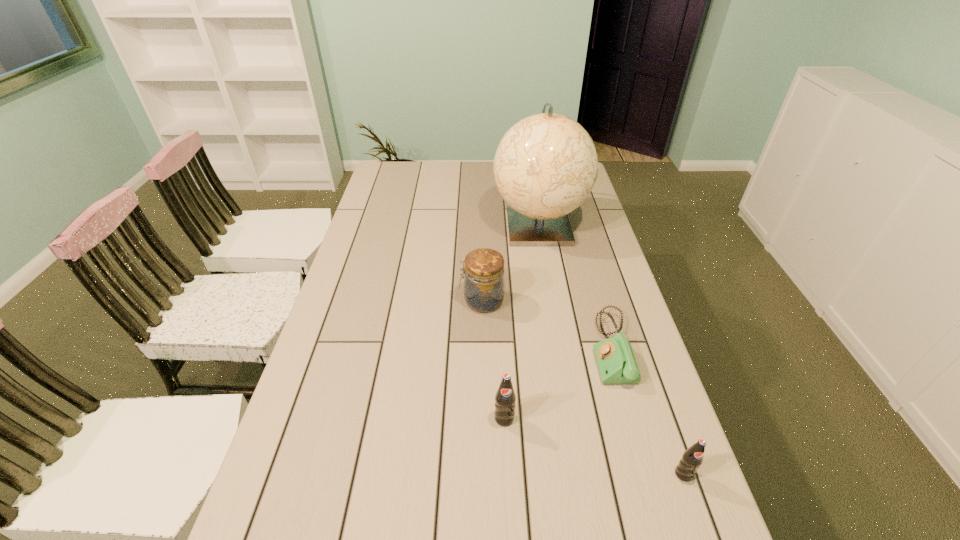
Please point a spot to add another pop on the left. Please provide its 2D coordinates. Your answer should be formatted as a tuple, i.e. [(x, y)], where the tuple contains the x and y coordinates of a point satisfying the conditions above.

[(356, 373)]